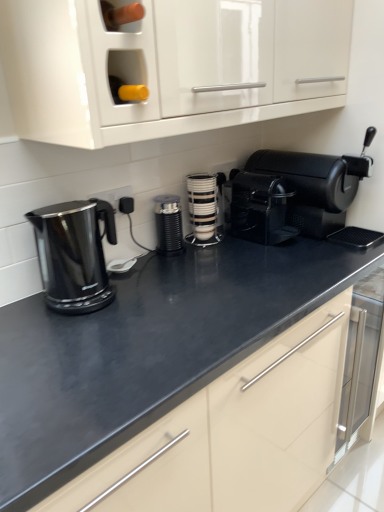
Question: From a real-world perspective, is black matte coffee grinder at center, which is the first kitchen appliance from left to right, physically located above or below black matte coffee machine at right?

Choices:
 (A) below
 (B) above

Answer: (A)

Question: Considering their positions, is black matte coffee grinder at center, which is counted as the second kitchen appliance, starting from the right, located in front of or behind black matte coffee machine at right?

Choices:
 (A) behind
 (B) front

Answer: (A)

Question: Which is nearer to the black glossy electric kettle at left?

Choices:
 (A) black matte coffee grinder at center, which is counted as the second kitchen appliance, starting from the right
 (B) black plastic coffee maker at center
 (C) black matte coffee machine at right
 (D) black plastic electric outlet at center
 (E) white glossy cup stack at center, which appears as the first kitchen appliance when viewed from the right

Answer: (D)

Question: Estimate the real-world distances between objects in this image. Which object is farther from the white glossy cup stack at center, which appears as the first kitchen appliance when viewed from the right?

Choices:
 (A) black matte coffee grinder at center, which is counted as the second kitchen appliance, starting from the right
 (B) black plastic electric outlet at center
 (C) black matte coffee machine at right
 (D) black plastic coffee maker at center
 (E) black glossy electric kettle at left

Answer: (E)